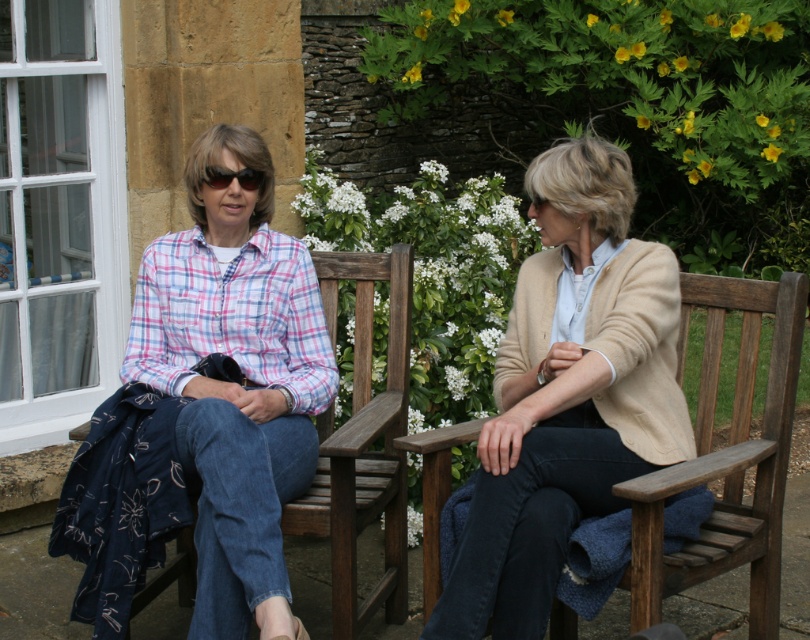
Who is more forward, (373, 515) or (222, 186)?

Point (222, 186) is more forward.

This screenshot has height=640, width=810. Describe the element at coordinates (361, 444) in the screenshot. I see `wooden bench at left` at that location.

Locate an element on the screen. The height and width of the screenshot is (640, 810). wooden bench at left is located at coordinates (361, 444).

Does beige wool cardigan at center have a lesser width compared to wooden bench at left?

Incorrect, beige wool cardigan at center's width is not less than wooden bench at left's.

How distant is beige wool cardigan at center from wooden bench at left?

The distance of beige wool cardigan at center from wooden bench at left is 25.90 inches.

Where is `beige wool cardigan at center`? Image resolution: width=810 pixels, height=640 pixels. beige wool cardigan at center is located at coordinates (567, 394).

The image size is (810, 640). I want to click on beige wool cardigan at center, so click(x=567, y=394).

Does point (593, 148) come farther from viewer compared to point (261, 177)?

No, it is in front of (261, 177).

Locate an element on the screen. Image resolution: width=810 pixels, height=640 pixels. beige wool cardigan at center is located at coordinates (567, 394).